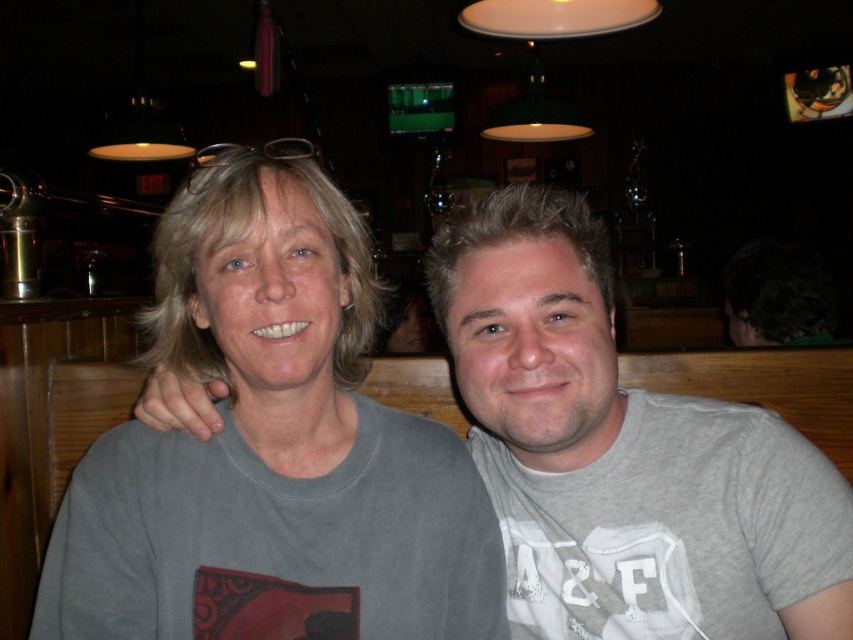
Who is more forward, (265,524) or (485,412)?

Point (265,524)

Locate an element on the screen. gray matte t-shirt at left is located at coordinates (271, 451).

Who is more forward, (x=309, y=518) or (x=733, y=328)?

Positioned in front is point (x=309, y=518).

Can you confirm if gray matte t-shirt at left is positioned to the left of dark hair at lower right?

Indeed, gray matte t-shirt at left is positioned on the left side of dark hair at lower right.

Locate an element on the screen. The height and width of the screenshot is (640, 853). gray matte t-shirt at left is located at coordinates (271, 451).

Does point (579, 477) lie behind point (787, 264)?

No, it is not.

Describe the element at coordinates (624, 452) in the screenshot. This screenshot has height=640, width=853. I see `gray cotton t-shirt at center` at that location.

Does point (561, 412) lie in front of point (722, 285)?

Yes, it is.

Find the location of a particular element. The image size is (853, 640). gray cotton t-shirt at center is located at coordinates (624, 452).